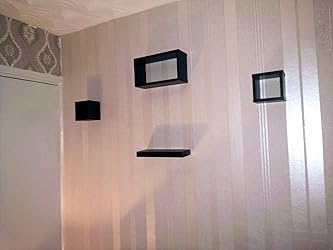
Please find where you'd enter the room in the image and show me where they are. Your answer should be formatted as a list of tuples, i.e. [(x1, y1), (x2, y2), ...], where each tuple contains the x and y coordinates of a point satisfying the conditions above.

[(9, 195)]